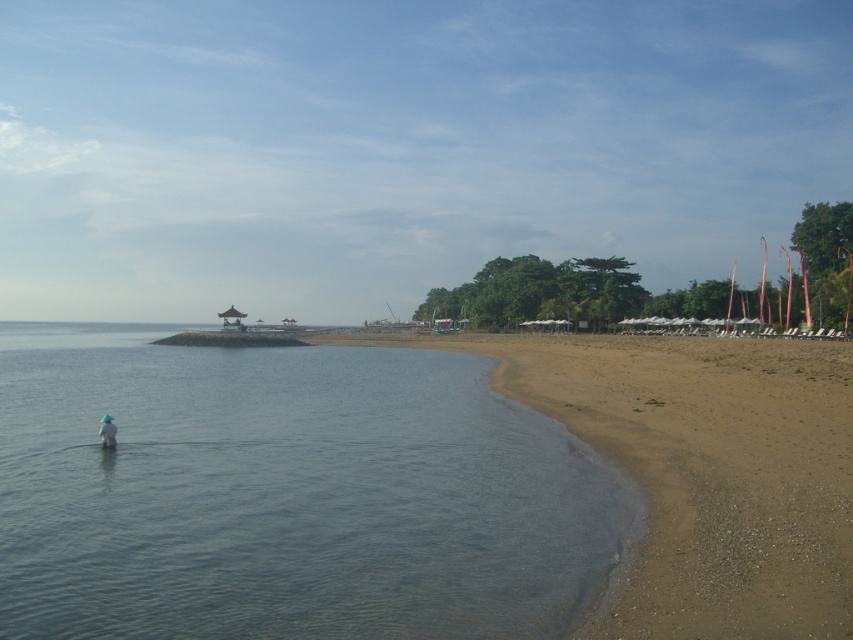
Question: Is clear water at lower left below white fabric hat at lower left?

Choices:
 (A) yes
 (B) no

Answer: (A)

Question: Which point is farther to the camera?

Choices:
 (A) white fabric hat at lower left
 (B) clear water at lower left
 (C) sandy beach at lower right

Answer: (A)

Question: Which point is closer to the camera?

Choices:
 (A) clear water at lower left
 (B) white fabric hat at lower left

Answer: (A)

Question: Can you confirm if sandy beach at lower right is bigger than white fabric hat at lower left?

Choices:
 (A) no
 (B) yes

Answer: (B)

Question: Which point is farther from the camera taking this photo?

Choices:
 (A) (138, 582)
 (B) (799, 492)

Answer: (B)

Question: Is the position of clear water at lower left less distant than that of white fabric hat at lower left?

Choices:
 (A) no
 (B) yes

Answer: (B)